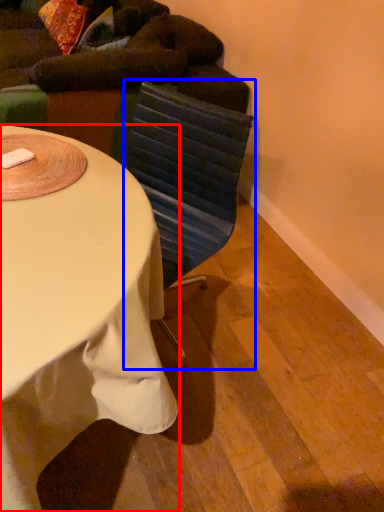
Question: Among these objects, which one is nearest to the camera, desk (highlighted by a red box) or swivel chair (highlighted by a blue box)?

Choices:
 (A) desk
 (B) swivel chair

Answer: (A)